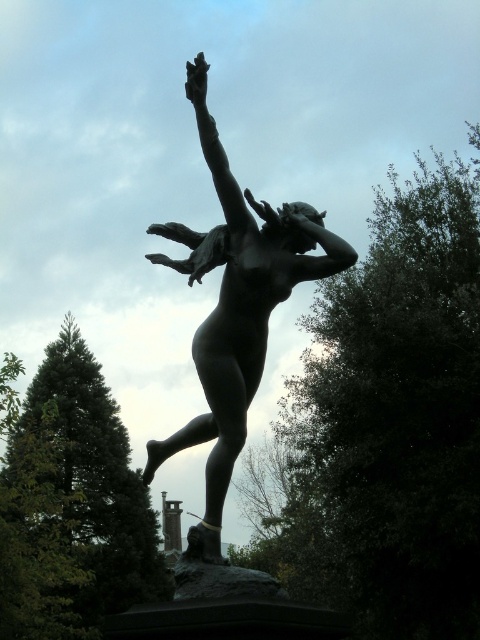
Who is lower down, bronze statue at center or bronze arm at upper center?

bronze statue at center is lower down.

Which of these two, bronze statue at center or bronze arm at upper center, stands shorter?

With less height is bronze arm at upper center.

The width and height of the screenshot is (480, 640). Describe the element at coordinates (236, 308) in the screenshot. I see `bronze statue at center` at that location.

This screenshot has height=640, width=480. In order to click on bronze statue at center in this screenshot , I will do coord(236,308).

Does bronze arm at upper center have a lesser width compared to matte bronze arm at center?

Incorrect, bronze arm at upper center's width is not less than matte bronze arm at center's.

Is bronze arm at upper center to the right of matte bronze arm at center from the viewer's perspective?

Incorrect, bronze arm at upper center is not on the right side of matte bronze arm at center.

Does point (201, 92) come behind point (336, 248)?

No.

Locate an element on the screen. The width and height of the screenshot is (480, 640). bronze arm at upper center is located at coordinates (216, 152).

Is bronze statue at center wider than matte bronze arm at center?

Yes.

Can you confirm if bronze statue at center is taller than matte bronze arm at center?

Yes.

Image resolution: width=480 pixels, height=640 pixels. What do you see at coordinates (236, 308) in the screenshot?
I see `bronze statue at center` at bounding box center [236, 308].

I want to click on bronze statue at center, so click(236, 308).